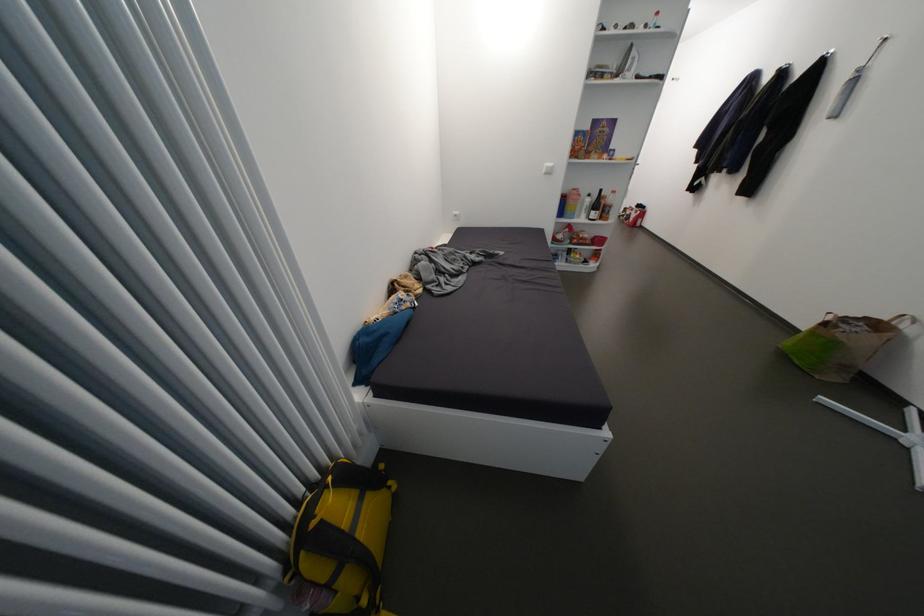
What do you see at coordinates (873, 323) in the screenshot? This screenshot has width=924, height=616. I see `the paper bag handle` at bounding box center [873, 323].